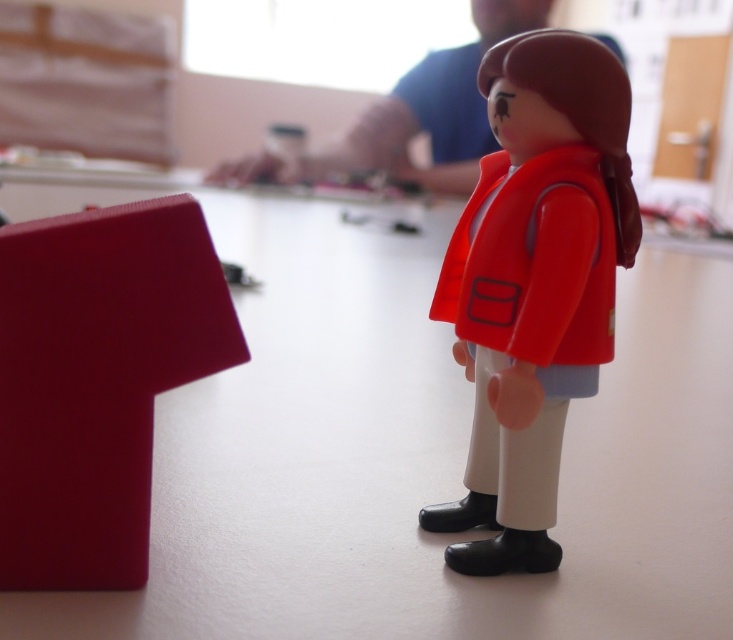
Question: Which point is closer to the camera taking this photo?

Choices:
 (A) (463, 72)
 (B) (575, 227)

Answer: (B)

Question: Which point is closer to the camera?

Choices:
 (A) (545, 440)
 (B) (226, 173)

Answer: (A)

Question: Considering the relative positions of matte plastic doll at center and matte plastic figure at upper center in the image provided, where is matte plastic doll at center located with respect to matte plastic figure at upper center?

Choices:
 (A) right
 (B) left

Answer: (A)

Question: Is matte plastic doll at center positioned behind matte plastic figure at upper center?

Choices:
 (A) no
 (B) yes

Answer: (A)

Question: Is matte plastic doll at center further to camera compared to matte plastic figure at upper center?

Choices:
 (A) yes
 (B) no

Answer: (B)